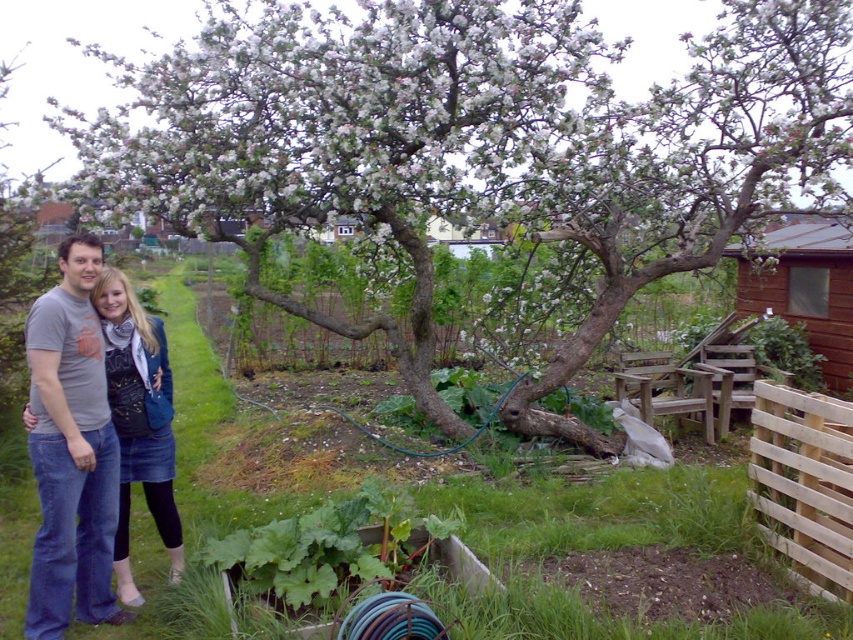
Is smooth bark tree at center above denim jacket at lower left?

Yes.

This screenshot has width=853, height=640. What do you see at coordinates (479, 145) in the screenshot?
I see `smooth bark tree at center` at bounding box center [479, 145].

Where is `smooth bark tree at center`? Image resolution: width=853 pixels, height=640 pixels. smooth bark tree at center is located at coordinates (479, 145).

This screenshot has width=853, height=640. What are the coordinates of `smooth bark tree at center` in the screenshot? It's located at (479, 145).

Is point (579, 352) closer to camera compared to point (830, 570)?

That is False.

This screenshot has width=853, height=640. Identify the location of smooth bark tree at center. (479, 145).

Does point (33, 572) come farther from viewer compared to point (811, 435)?

No, (33, 572) is closer to viewer.

Is point (106, 464) positioned before point (805, 476)?

That is True.

I want to click on denim jacket at lower left, so click(x=71, y=451).